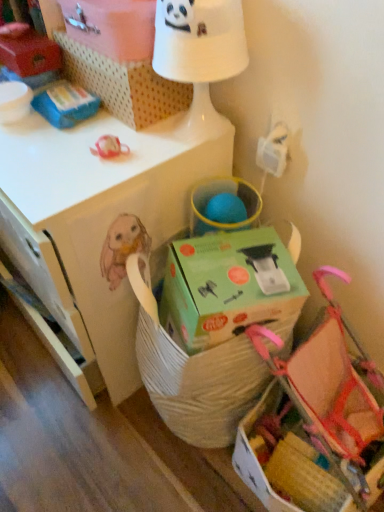
Question: Is white cardboard box at upper center, the second storage box in the left-to-right sequence, next to white cardboard box at upper center, the 1th cardboard box when ordered from top to bottom, and touching it?

Choices:
 (A) yes
 (B) no

Answer: (A)

Question: Considering the relative sizes of white cardboard box at upper center, which is the first storage box in right-to-left order, and white cardboard box at upper center, the 1th cardboard box when ordered from top to bottom, in the image provided, is white cardboard box at upper center, which is the first storage box in right-to-left order, bigger than white cardboard box at upper center, the 1th cardboard box when ordered from top to bottom,?

Choices:
 (A) yes
 (B) no

Answer: (A)

Question: Is white cardboard box at upper center, which is the first storage box in right-to-left order, to the right of white cardboard box at upper center, the 1th cardboard box when ordered from top to bottom, from the viewer's perspective?

Choices:
 (A) no
 (B) yes

Answer: (A)

Question: Does white cardboard box at upper center, which is the first storage box in right-to-left order, have a greater width compared to white cardboard box at upper center, the 1th cardboard box when ordered from top to bottom?

Choices:
 (A) yes
 (B) no

Answer: (A)

Question: Is white cardboard box at upper center, the second storage box in the left-to-right sequence, positioned beyond the bounds of white cardboard box at upper center, the 1th cardboard box when ordered from top to bottom?

Choices:
 (A) no
 (B) yes

Answer: (B)

Question: From a real-world perspective, is matte plastic storage box at upper left, which appears as the 2th storage box when viewed from the right, above or below white cardboard box at upper center, which is the second cardboard box from bottom to top?

Choices:
 (A) above
 (B) below

Answer: (B)

Question: Is matte plastic storage box at upper left, the first storage box in the left-to-right sequence, spatially inside white cardboard box at upper center, which is the second cardboard box from bottom to top, or outside of it?

Choices:
 (A) outside
 (B) inside

Answer: (A)

Question: Considering the positions of point (0, 42) and point (92, 46), is point (0, 42) closer or farther from the camera than point (92, 46)?

Choices:
 (A) farther
 (B) closer

Answer: (A)

Question: Would you say matte plastic storage box at upper left, the first storage box in the left-to-right sequence, is to the left or to the right of white cardboard box at upper center, which is the second cardboard box from bottom to top, in the picture?

Choices:
 (A) left
 (B) right

Answer: (A)

Question: Is white cardboard box at upper center, the 1th cardboard box when ordered from top to bottom, bigger or smaller than white cardboard box at upper center, which is the first storage box in right-to-left order?

Choices:
 (A) big
 (B) small

Answer: (B)

Question: Is white cardboard box at upper center, the 1th cardboard box when ordered from top to bottom, in front of or behind white cardboard box at upper center, which is the first storage box in right-to-left order, in the image?

Choices:
 (A) front
 (B) behind

Answer: (A)

Question: Considering the relative positions of white cardboard box at upper center, the 1th cardboard box when ordered from top to bottom, and white cardboard box at upper center, the second storage box in the left-to-right sequence, in the image provided, is white cardboard box at upper center, the 1th cardboard box when ordered from top to bottom, to the left or to the right of white cardboard box at upper center, the second storage box in the left-to-right sequence,?

Choices:
 (A) left
 (B) right

Answer: (B)

Question: From a real-world perspective, is white cardboard box at upper center, the 1th cardboard box when ordered from top to bottom, above or below white cardboard box at upper center, the second storage box in the left-to-right sequence?

Choices:
 (A) above
 (B) below

Answer: (A)

Question: Is white glossy table lamp at upper center to the left or to the right of white matte desk at center in the image?

Choices:
 (A) right
 (B) left

Answer: (A)

Question: Do you think white glossy table lamp at upper center is within white matte desk at center, or outside of it?

Choices:
 (A) inside
 (B) outside

Answer: (B)